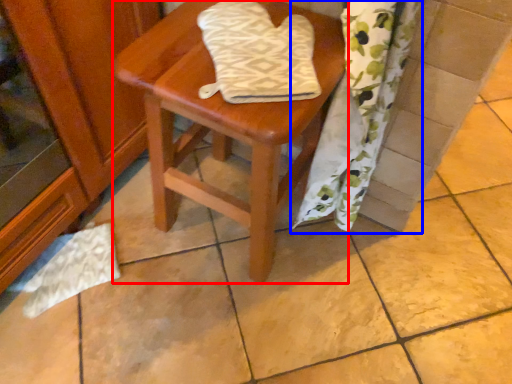
Question: Which of the following is the closest to the observer, stool (highlighted by a red box) or curtain (highlighted by a blue box)?

Choices:
 (A) stool
 (B) curtain

Answer: (B)